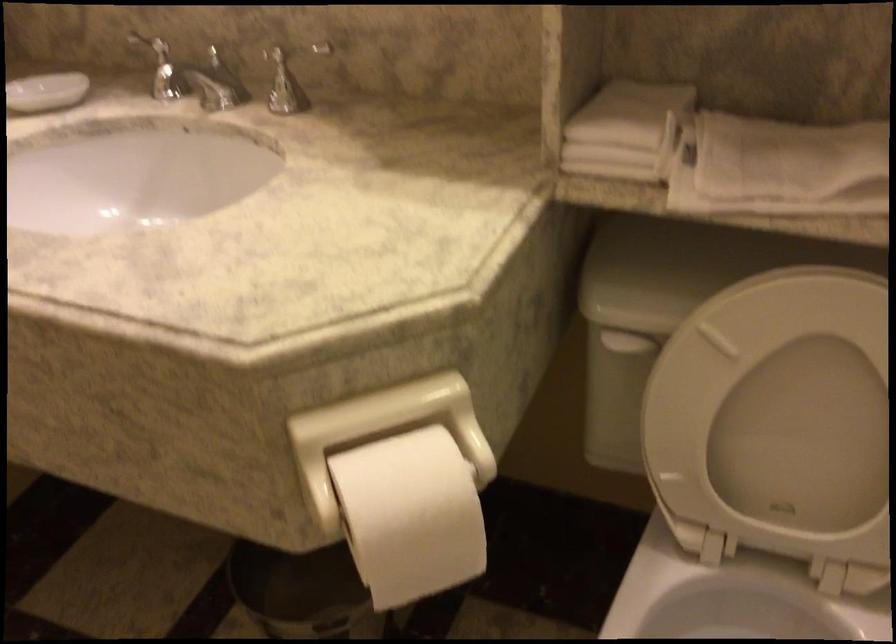
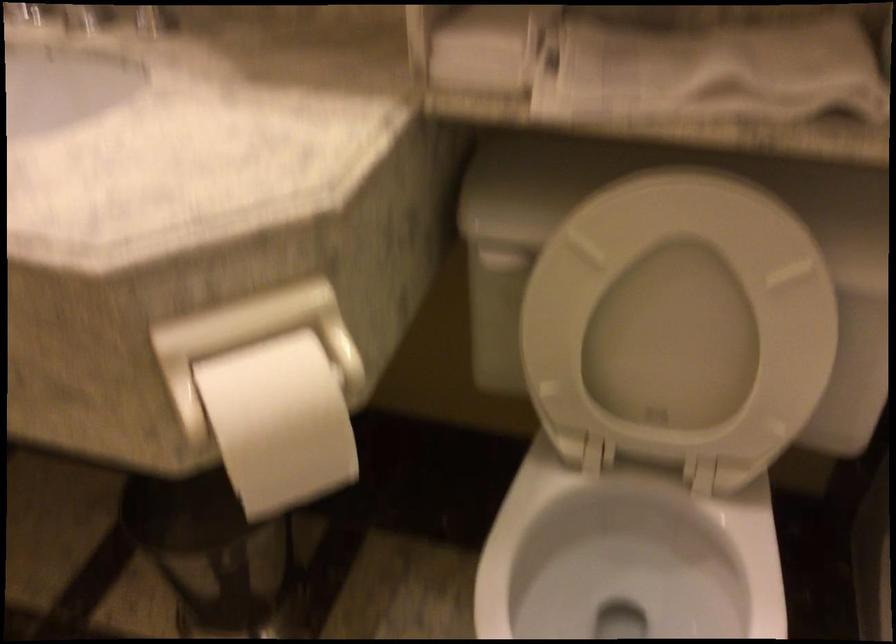
The point at (813, 415) is marked in the first image. Where is the corresponding point in the second image?

(678, 322)